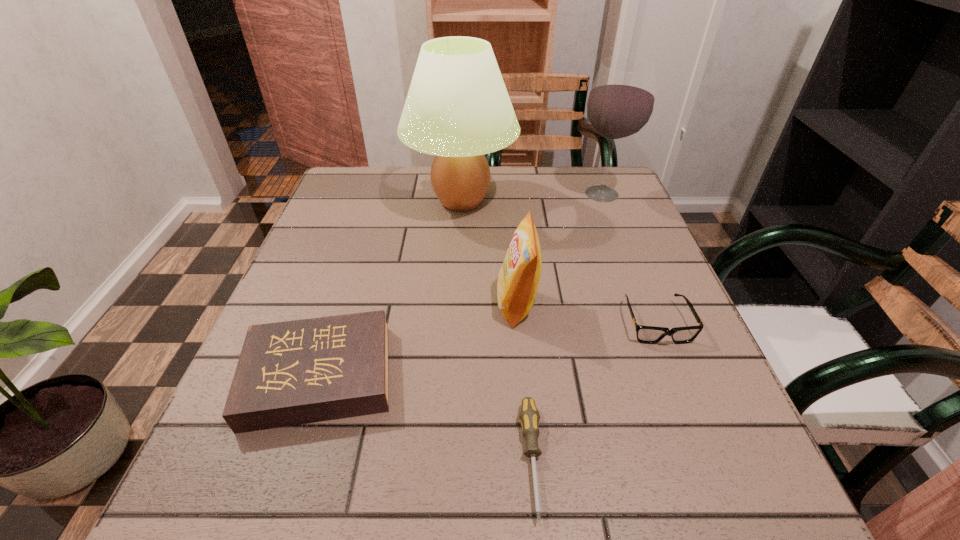
In the image, there is a desktop. Where is `vacant space at the far edge`? vacant space at the far edge is located at coordinates (559, 198).

In the image, there is a desktop. Where is `vacant space at the near edge`? vacant space at the near edge is located at coordinates (395, 511).

I want to click on vacant space at the left edge of the desktop, so click(377, 227).

In the image, there is a desktop. Where is `blank space at the right edge`? blank space at the right edge is located at coordinates (679, 376).

Image resolution: width=960 pixels, height=540 pixels. In the image, there is a desktop. What are the coordinates of `free space at the far left corner` in the screenshot? It's located at (350, 194).

The width and height of the screenshot is (960, 540). I want to click on free space at the near left corner of the desktop, so click(x=251, y=525).

Locate an element on the screen. Image resolution: width=960 pixels, height=540 pixels. free region at the far right corner of the desktop is located at coordinates (605, 211).

Where is `blank region between the hardback book and the lampshade`? The height and width of the screenshot is (540, 960). blank region between the hardback book and the lampshade is located at coordinates (391, 288).

Where is `free space between the fifth tallest object and the alcohol`? The image size is (960, 540). free space between the fifth tallest object and the alcohol is located at coordinates (629, 258).

At what (x,y) coordinates should I click in order to perform the action: click on free spot between the screwdriver and the lampshade. Please return your answer as a coordinate pair (x, y). Looking at the image, I should click on (496, 329).